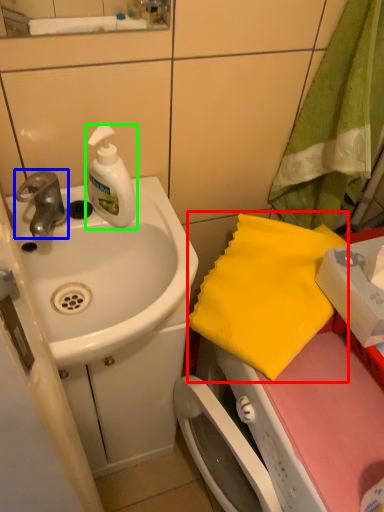
Question: Which is nearer to the beach towel (highlighted by a red box)? tap (highlighted by a blue box) or soap dispenser (highlighted by a green box).

Choices:
 (A) tap
 (B) soap dispenser

Answer: (B)